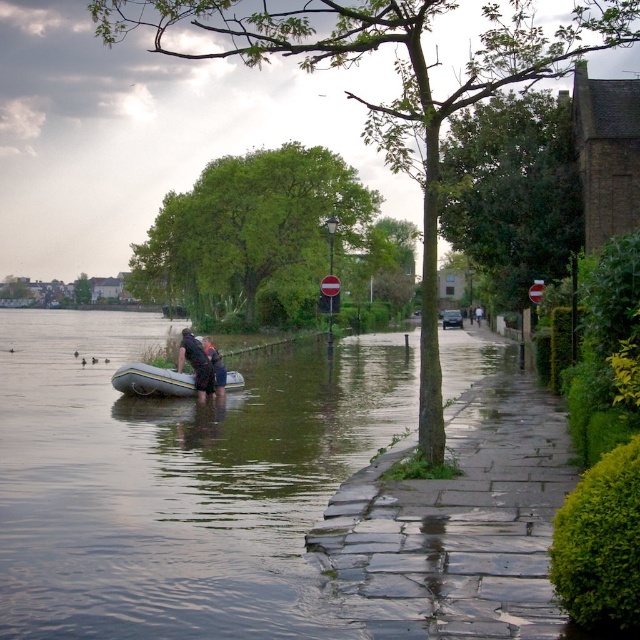
Question: Is yellow rubber raft at lower left above dark blue fabric person at center?

Choices:
 (A) yes
 (B) no

Answer: (B)

Question: Which of these objects is positioned closest to the dark blue fabric jacket at lower center?

Choices:
 (A) translucent rubber raft at lower left
 (B) yellow rubber raft at lower left

Answer: (B)

Question: Can you confirm if translucent rubber raft at lower left is thinner than yellow rubber raft at lower left?

Choices:
 (A) no
 (B) yes

Answer: (A)

Question: Which point is closer to the camera?

Choices:
 (A) dark blue fabric person at center
 (B) translucent rubber raft at lower left
 (C) dark blue fabric jacket at lower center
 (D) yellow rubber raft at lower left

Answer: (B)

Question: Which object is farther from the camera taking this photo?

Choices:
 (A) dark blue fabric person at center
 (B) yellow rubber raft at lower left
 (C) translucent rubber raft at lower left

Answer: (A)

Question: Can you confirm if translucent rubber raft at lower left is bigger than dark blue fabric person at center?

Choices:
 (A) yes
 (B) no

Answer: (A)